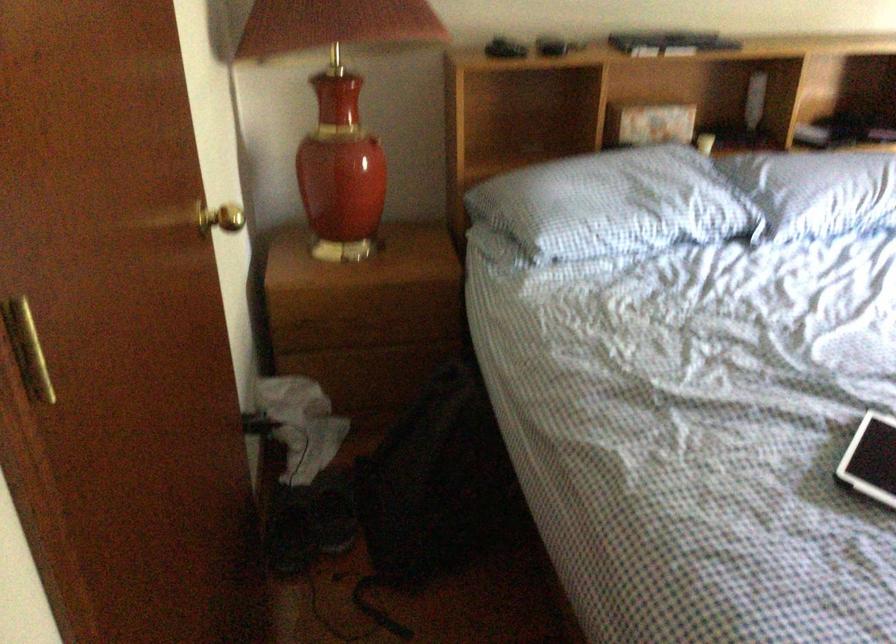
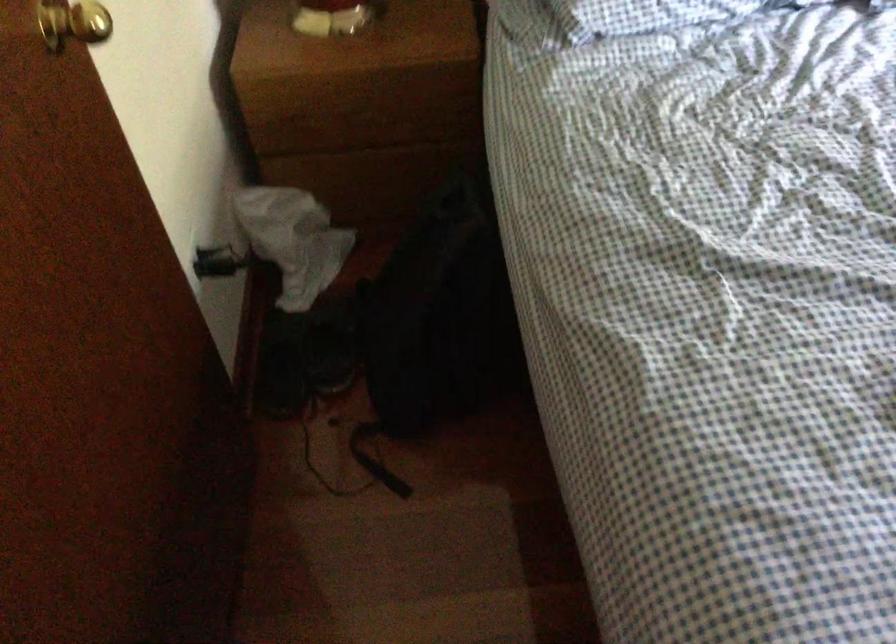
Question: What movement of the cameraman would produce the second image?

Choices:
 (A) Left
 (B) Right
 (C) Forward
 (D) Backward

Answer: (C)